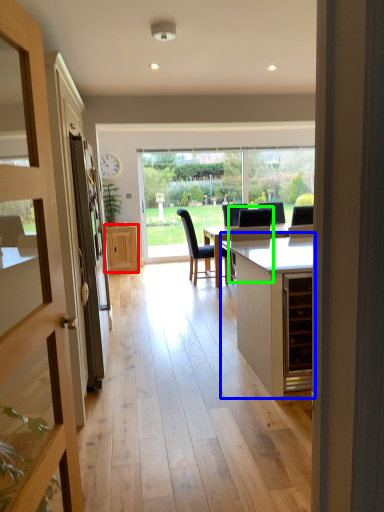
Question: Estimate the real-world distances between objects in this image. Which object is farther from cabinetry (highlighted by a red box), cabinetry (highlighted by a blue box) or swivel chair (highlighted by a green box)?

Choices:
 (A) cabinetry
 (B) swivel chair

Answer: (A)